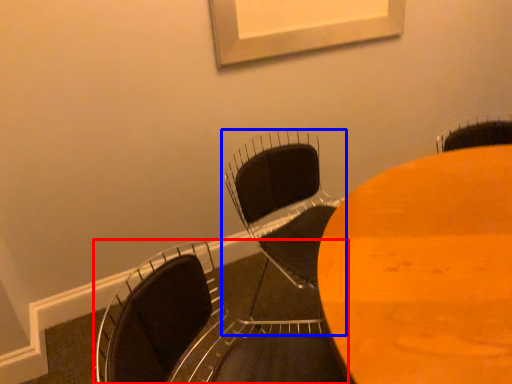
Question: Which object is closer to the camera taking this photo, chair (highlighted by a red box) or chair (highlighted by a blue box)?

Choices:
 (A) chair
 (B) chair

Answer: (A)